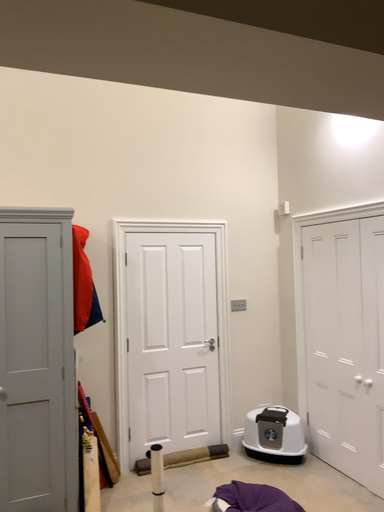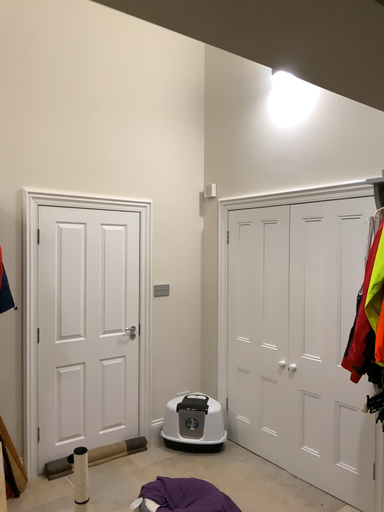
Question: How did the camera likely rotate when shooting the video?

Choices:
 (A) rotated right
 (B) rotated left

Answer: (A)